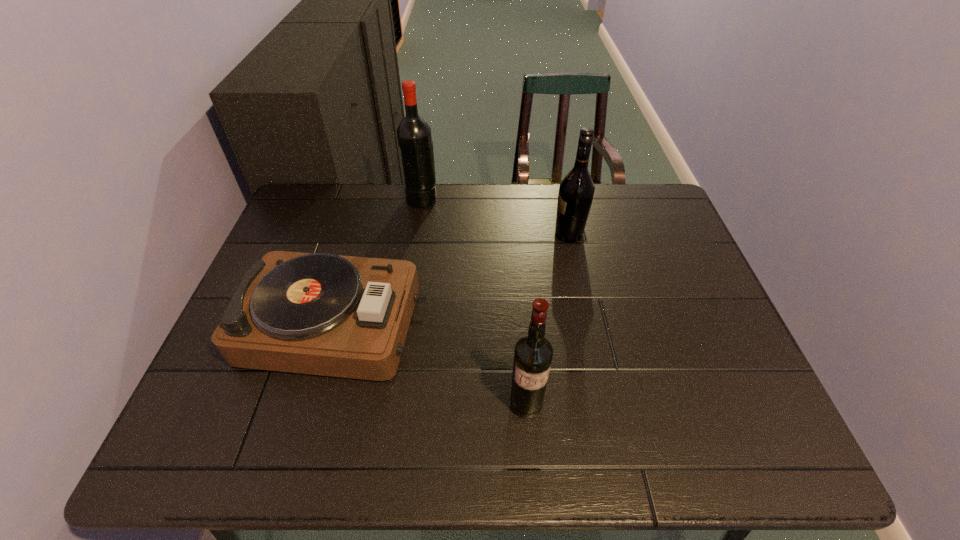
Identify the location of the leftmost wine bottle. click(x=414, y=137).

Where is `the farthest wine bottle`? The width and height of the screenshot is (960, 540). the farthest wine bottle is located at coordinates (414, 137).

Locate an element on the screen. The width and height of the screenshot is (960, 540). the rightmost wine bottle is located at coordinates (576, 191).

Locate an element on the screen. the second nearest wine bottle is located at coordinates point(576,191).

This screenshot has height=540, width=960. In order to click on the second wine bottle from right to left in this screenshot , I will do `click(533, 353)`.

The width and height of the screenshot is (960, 540). I want to click on the nearest object, so click(x=533, y=353).

Identify the location of the third farthest object. (322, 314).

Identify the location of the shortest object. This screenshot has width=960, height=540. (322, 314).

Find the location of a particular element. The image size is (960, 540). free region located on the front of the farthest object is located at coordinates (406, 301).

At what (x,y) coordinates should I click in order to perform the action: click on free point located on the label of the rightmost wine bottle. Please return your answer as a coordinate pair (x, y). Image resolution: width=960 pixels, height=540 pixels. Looking at the image, I should click on (443, 234).